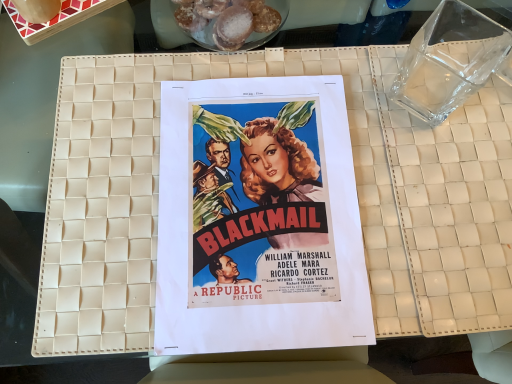
Question: Is sugared doughnuts at upper center taller or shorter than matte paper poster at center?

Choices:
 (A) tall
 (B) short

Answer: (A)

Question: Would you say sugared doughnuts at upper center is inside or outside matte paper poster at center?

Choices:
 (A) inside
 (B) outside

Answer: (B)

Question: In terms of width, does sugared doughnuts at upper center look wider or thinner when compared to matte paper poster at center?

Choices:
 (A) thin
 (B) wide

Answer: (A)

Question: Which is correct: matte paper poster at center is inside sugared doughnuts at upper center, or outside of it?

Choices:
 (A) outside
 (B) inside

Answer: (A)

Question: From the image's perspective, relative to sugared doughnuts at upper center, is matte paper poster at center above or below?

Choices:
 (A) below
 (B) above

Answer: (A)

Question: Would you say matte paper poster at center is to the left or to the right of sugared doughnuts at upper center in the picture?

Choices:
 (A) left
 (B) right

Answer: (B)

Question: Relative to sugared doughnuts at upper center, is matte paper poster at center in front or behind?

Choices:
 (A) behind
 (B) front

Answer: (B)